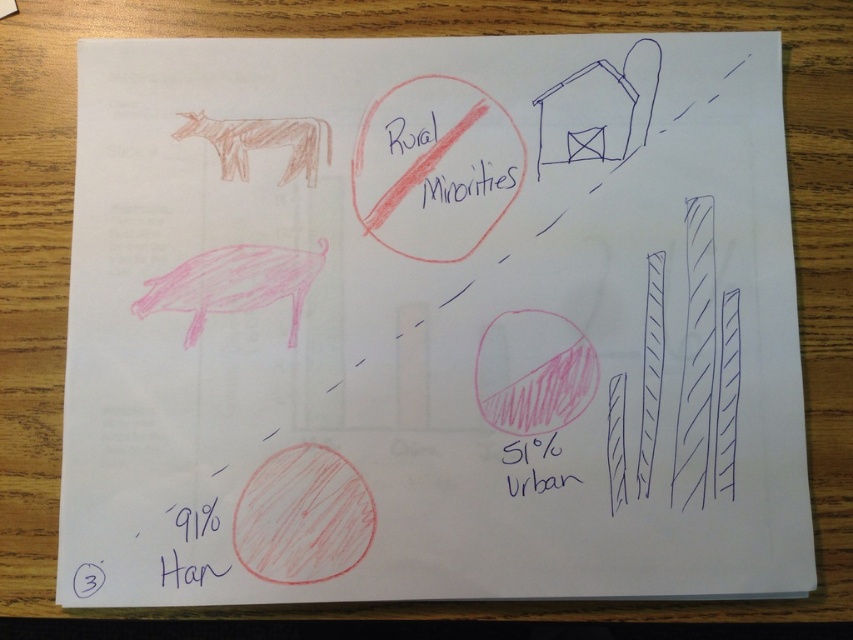
You are organizing a school project and need to identify which text is easier to read from a distance. Based on the image, which text would you choose between the black handwritten text at lower left and the pink handwritten text at lower center?

The black handwritten text at lower left has a larger size compared to the pink handwritten text at lower center, so it would be easier to read from a distance.

You are looking at a paper with two texts, the black handwritten text at lower left and the pink handwritten text at lower center. Which text is nearer to you?

The black handwritten text at lower left is closer to the viewer than the pink handwritten text at lower center.

You are looking at a paper on a wooden table. There is black ink text at center and pink handwritten text at lower center. Which text is positioned higher on the paper?

The black ink text at center is located above the pink handwritten text at lower center, so the black ink text at center is positioned higher.